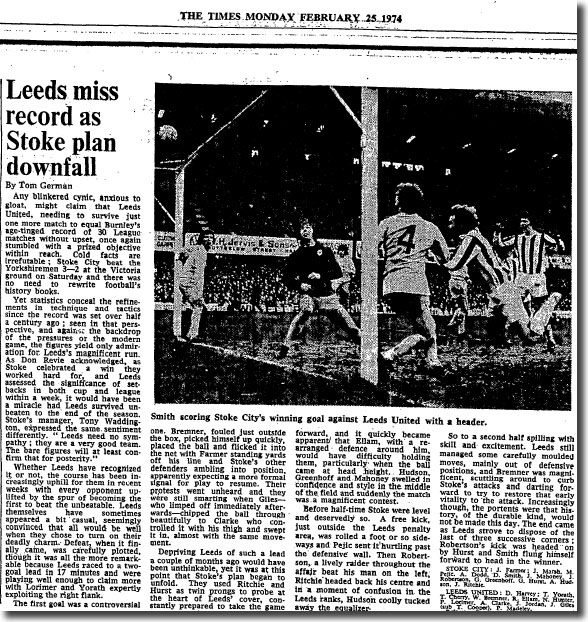
Locate an element on the screen. lights is located at coordinates (268, 160).